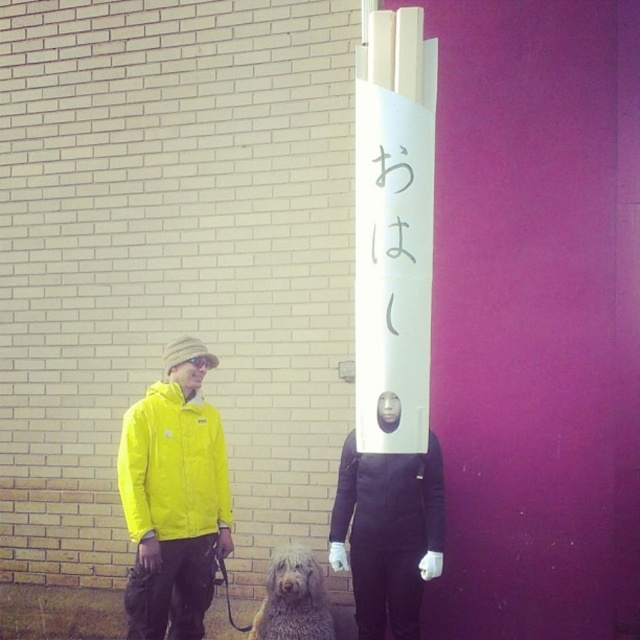
Question: Can you confirm if black matte jacket at center is smaller than gray shaggy dog at lower center?

Choices:
 (A) no
 (B) yes

Answer: (A)

Question: Is yellow matte jacket at left to the right of black matte jacket at center from the viewer's perspective?

Choices:
 (A) no
 (B) yes

Answer: (A)

Question: Which object is farther from the camera taking this photo?

Choices:
 (A) yellow matte jacket at left
 (B) black matte jacket at center

Answer: (A)

Question: Which object is positioned closest to the black matte jacket at center?

Choices:
 (A) gray shaggy dog at lower center
 (B) yellow matte jacket at left

Answer: (A)

Question: Is yellow matte jacket at left above gray shaggy dog at lower center?

Choices:
 (A) no
 (B) yes

Answer: (B)

Question: Which object appears farthest from the camera in this image?

Choices:
 (A) black matte jacket at center
 (B) gray shaggy dog at lower center

Answer: (B)